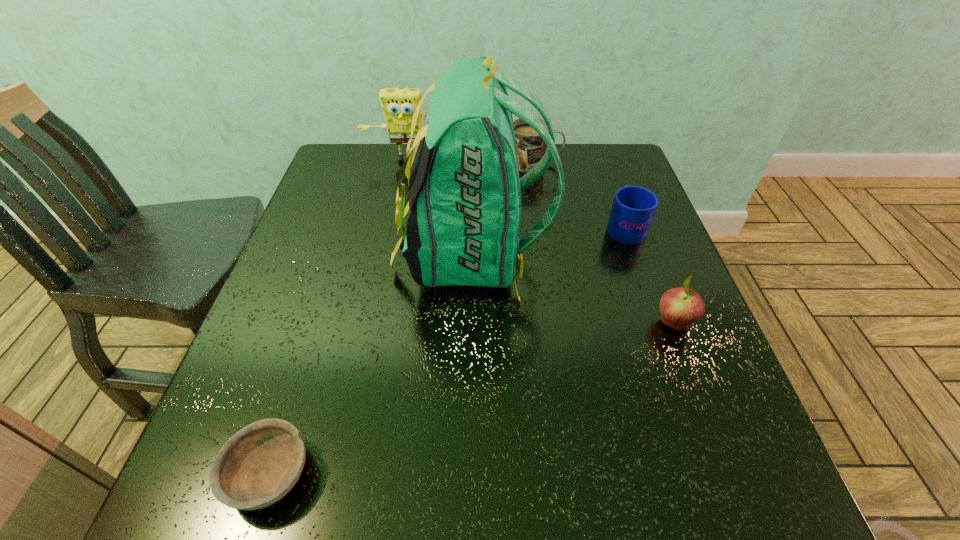
I want to click on vacant area that lies between the left mug and the nearest object, so click(x=402, y=319).

The image size is (960, 540). I want to click on free point between the nearest object and the apple, so click(x=471, y=399).

You are a GUI agent. You are given a task and a screenshot of the screen. Output one action in this format:
    pyautogui.click(x=<x>, y=<y>)
    Task: Click on the free space between the bowl and the farther mug
    
    Given the screenshot: What is the action you would take?
    pyautogui.click(x=402, y=319)

The image size is (960, 540). I want to click on vacant region between the sponge and the second nearest object, so click(540, 241).

Image resolution: width=960 pixels, height=540 pixels. What are the coordinates of `free space that is in between the left mug and the shortest object` in the screenshot? It's located at (402, 319).

This screenshot has height=540, width=960. In order to click on vacant area between the nearest object and the right mug in this screenshot , I will do `click(447, 350)`.

This screenshot has height=540, width=960. Find the location of `unoccupied position between the right mug and the apple`. unoccupied position between the right mug and the apple is located at coordinates (649, 275).

Identify which object is the fifth nearest to the second nearest object. Please provide its 2D coordinates. Your answer should be formatted as a tuple, i.e. [(x, y)], where the tuple contains the x and y coordinates of a point satisfying the conditions above.

[(398, 105)]

Point out which object is positioned as the fourth nearest to the nearer mug. Please provide its 2D coordinates. Your answer should be formatted as a tuple, i.e. [(x, y)], where the tuple contains the x and y coordinates of a point satisfying the conditions above.

[(398, 105)]

Image resolution: width=960 pixels, height=540 pixels. I want to click on free space that satisfies the following two spatial constraints: 1. on the face of the sponge; 2. on the right side of the fifth farthest object, so click(x=373, y=323).